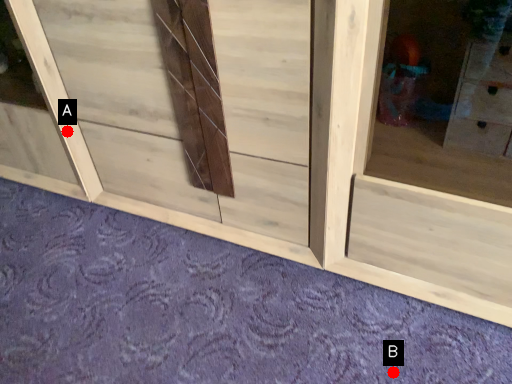
Question: Two points are circled on the image, labeled by A and B beside each circle. Among these points, which one is nearest to the camera?

Choices:
 (A) A is closer
 (B) B is closer

Answer: (B)